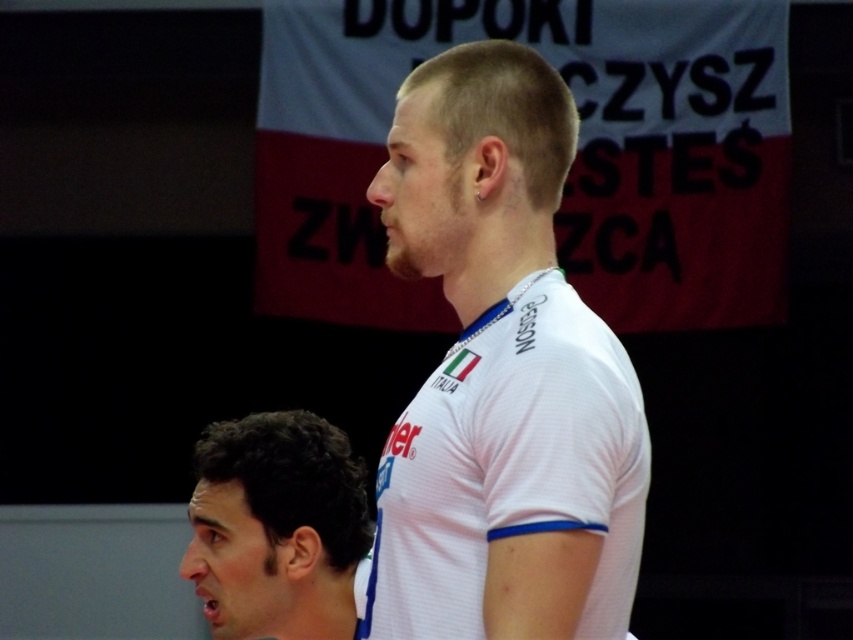
You are a photographer at a sports event. You need to capture a clear shot of the white jersey at center and the dark curly hair at lower left. Can you position yourself so that both are visible in the frame without one blocking the other?

The white jersey at center is above dark curly hair at lower left, so positioning the camera below the white jersey at center and angled upwards would allow both to be visible without obstruction.

What is the location of the point with coordinates (502, 376) in the image?

The point with coordinates (502, 376) is located on the white jersey at center.

You are a photographer at a sports event and need to capture a clear shot of the dark curly hair at lower left without the white jersey at center blocking it. What should you do?

Move your position to the side so that the dark curly hair at lower left is no longer behind the white jersey at center.